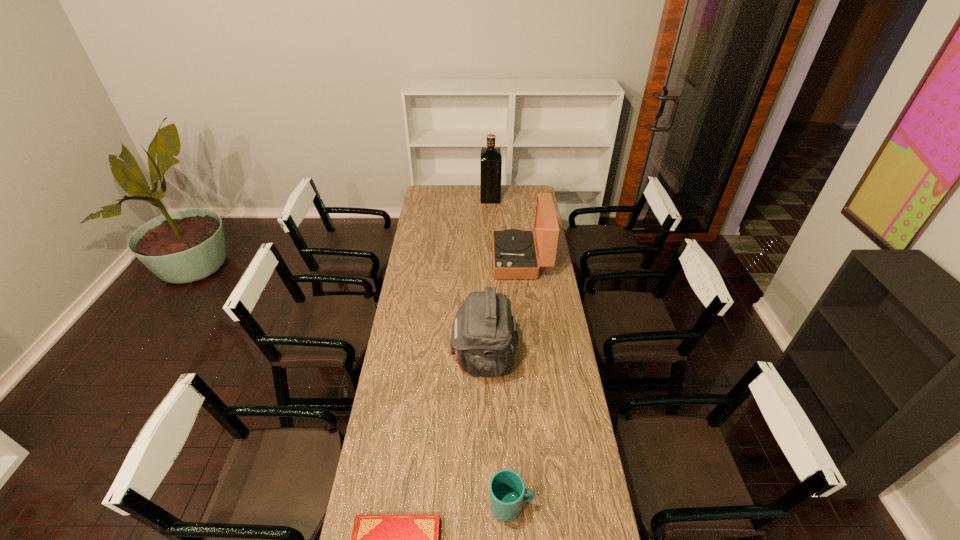
Find the location of a particular element. The width and height of the screenshot is (960, 540). the tallest object is located at coordinates (490, 157).

Image resolution: width=960 pixels, height=540 pixels. In order to click on liquor in this screenshot , I will do `click(490, 157)`.

Find the location of `the third farthest object`. the third farthest object is located at coordinates (484, 337).

Find the location of a particular element. the second farthest object is located at coordinates (x=514, y=253).

Where is `cup`? cup is located at coordinates (507, 489).

The image size is (960, 540). What are the coordinates of `free space located on the front label of the liquor` in the screenshot? It's located at (460, 197).

Find the location of a particular element. vacant area located on the front label of the liquor is located at coordinates (437, 197).

Where is `vacant region located 0.210m on the front label of the liquor`? Image resolution: width=960 pixels, height=540 pixels. vacant region located 0.210m on the front label of the liquor is located at coordinates (447, 197).

Locate an element on the screen. This screenshot has width=960, height=540. vacant space situated 0.110m on the open flap of the shoulder bag is located at coordinates (425, 357).

The image size is (960, 540). Find the location of `free space located 0.200m on the open flap of the shoulder bag`. free space located 0.200m on the open flap of the shoulder bag is located at coordinates (403, 357).